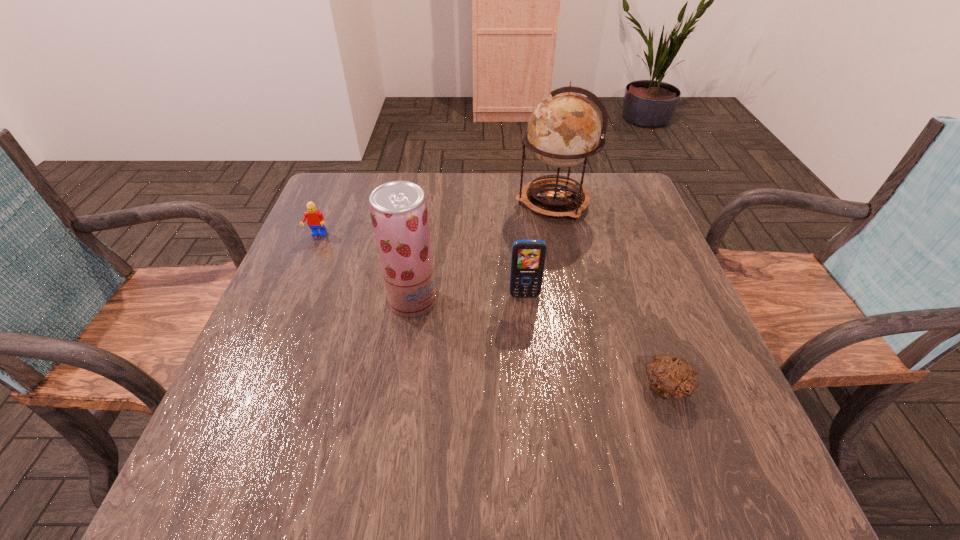
I want to click on the tallest object, so click(x=564, y=129).

Where is `globe`? The image size is (960, 540). globe is located at coordinates (564, 129).

This screenshot has width=960, height=540. What are the coordinates of `the second tallest object` in the screenshot? It's located at (399, 213).

Where is `fruit juice`? Image resolution: width=960 pixels, height=540 pixels. fruit juice is located at coordinates (399, 213).

At what (x,y) coordinates should I click in order to perform the action: click on cellular telephone. Please return your answer as a coordinate pair (x, y). The image size is (960, 540). Looking at the image, I should click on (528, 256).

What are the coordinates of `the leftmost object` in the screenshot? It's located at [315, 220].

Where is `Lego`? Image resolution: width=960 pixels, height=540 pixels. Lego is located at coordinates (315, 220).

Locate an element on the screen. The image size is (960, 540). muffin is located at coordinates (671, 377).

The image size is (960, 540). Identify the location of the shortest object. (671, 377).

Locate an element on the screen. The height and width of the screenshot is (540, 960). vacant space situated 0.150m at the center of the tallest object is located at coordinates (462, 202).